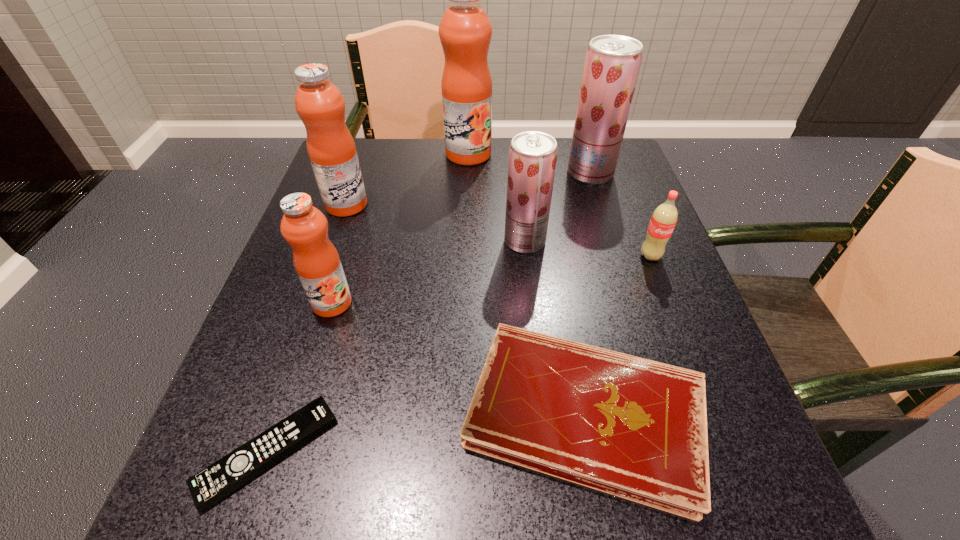
Where is `the tallest object`? The width and height of the screenshot is (960, 540). the tallest object is located at coordinates (465, 31).

Where is `the third fruit juice from right to left`? the third fruit juice from right to left is located at coordinates (465, 31).

The height and width of the screenshot is (540, 960). I want to click on the farther strawberry fruit juice, so click(612, 63).

Locate an element on the screen. The height and width of the screenshot is (540, 960). the rightmost fruit juice is located at coordinates [x=612, y=63].

Where is `the second nearest orange fruit juice`? This screenshot has width=960, height=540. the second nearest orange fruit juice is located at coordinates (319, 103).

Where is `the third farthest fruit juice`? Image resolution: width=960 pixels, height=540 pixels. the third farthest fruit juice is located at coordinates (319, 103).

Where is `the left strawberry fruit juice`? The image size is (960, 540). the left strawberry fruit juice is located at coordinates (532, 155).

Where is `the smaller strawberry fruit juice`? The image size is (960, 540). the smaller strawberry fruit juice is located at coordinates (532, 155).

The width and height of the screenshot is (960, 540). What are the coordinates of `the nearest fruit juice` in the screenshot? It's located at (305, 228).

Locate an element on the screen. The height and width of the screenshot is (540, 960). the nearest orange fruit juice is located at coordinates pos(305,228).